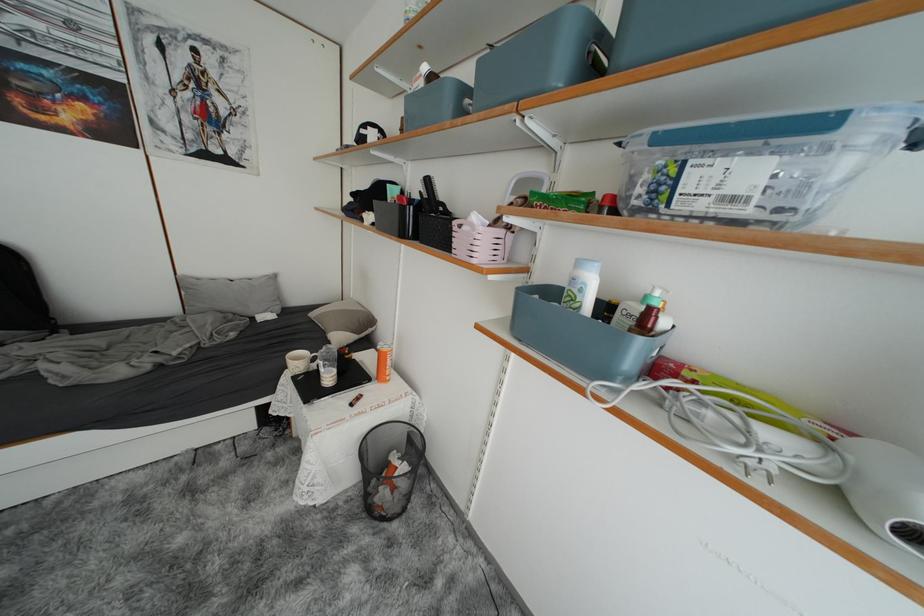
You are a GUI agent. You are given a task and a screenshot of the screen. Output one action in this format:
    pyautogui.click(x=<x>, y=<y>)
    Task: Click on the blue bin handle
    
    Given the screenshot: What is the action you would take?
    pyautogui.click(x=758, y=164)